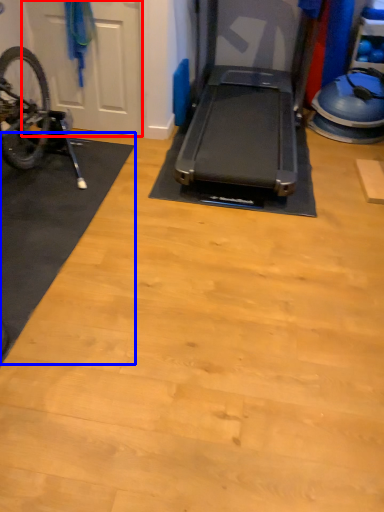
Question: Which of the following is the closest to the observer, garage door (highlighted by a red box) or mat (highlighted by a blue box)?

Choices:
 (A) garage door
 (B) mat

Answer: (B)